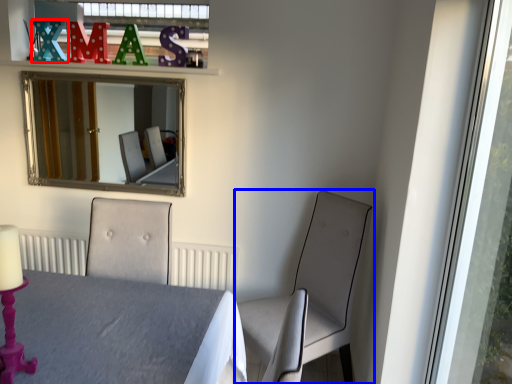
Question: Which object is further to the camera taking this photo, alphabet (highlighted by a red box) or chair (highlighted by a blue box)?

Choices:
 (A) alphabet
 (B) chair

Answer: (A)